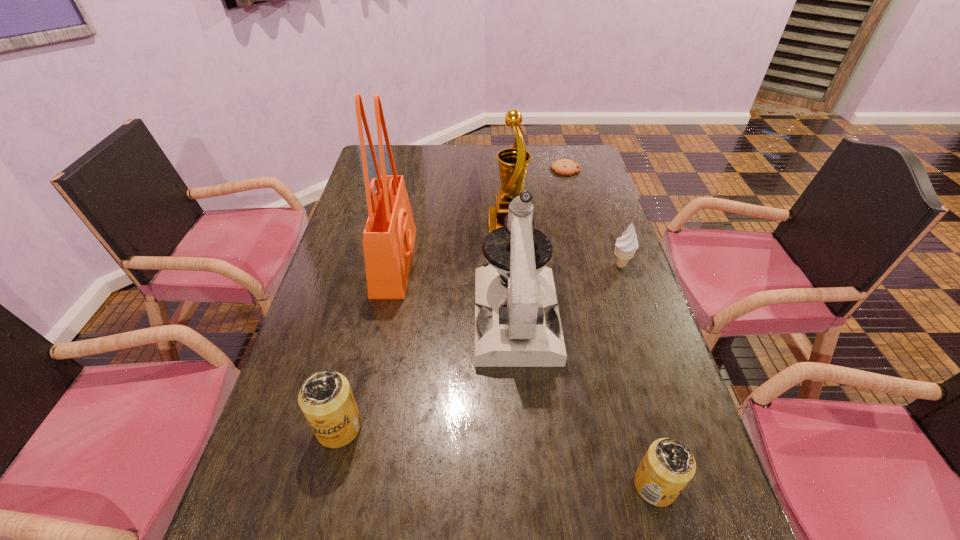
Identify the location of the second nearest object. The image size is (960, 540). (325, 398).

I want to click on the farther beer can, so click(x=325, y=398).

The height and width of the screenshot is (540, 960). Find the location of `the nearest object`. the nearest object is located at coordinates (668, 466).

The image size is (960, 540). I want to click on the shorter beer can, so pos(668,466).

What are the coordinates of `the shortest object` in the screenshot? It's located at pos(565,167).

Locate an element on the screen. Image resolution: width=960 pixels, height=540 pixels. cookie is located at coordinates (565, 167).

Where is `the tallest object`? the tallest object is located at coordinates click(388, 239).

Image resolution: width=960 pixels, height=540 pixels. I want to click on award, so 513,162.

I want to click on icecream, so click(x=626, y=245).

Find the location of a particular element. microscope is located at coordinates (519, 326).